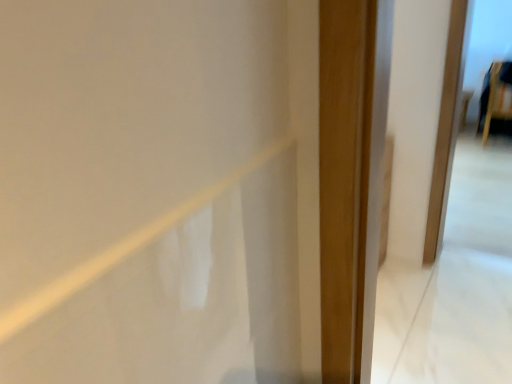
This screenshot has width=512, height=384. What do you see at coordinates (497, 101) in the screenshot? I see `wooden chair at upper right` at bounding box center [497, 101].

Where is `wooden chair at upper right`? wooden chair at upper right is located at coordinates (497, 101).

Locate an element on the screen. The width and height of the screenshot is (512, 384). wooden chair at upper right is located at coordinates (497, 101).